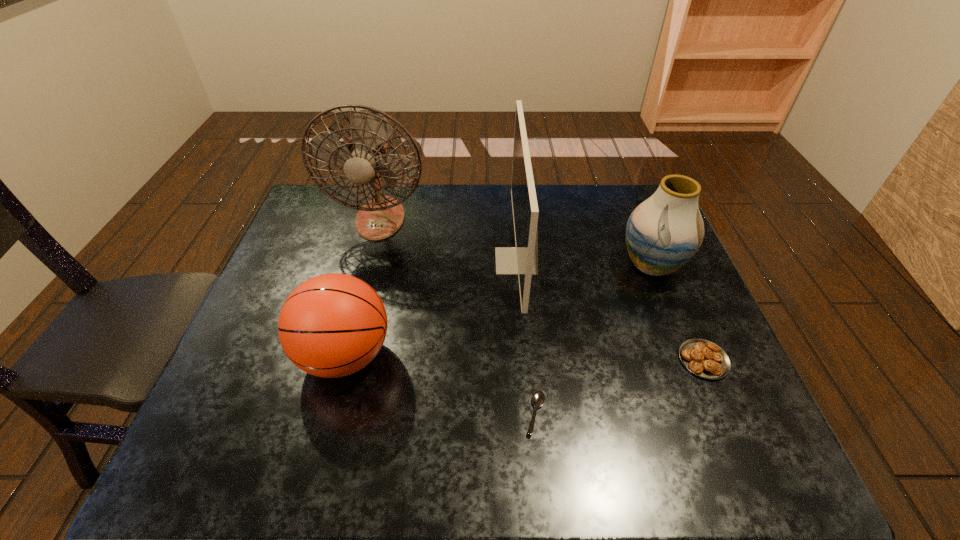
The image size is (960, 540). Find the location of `free space located on the front of the third tallest object`. free space located on the front of the third tallest object is located at coordinates (677, 327).

You are a GUI agent. You are given a task and a screenshot of the screen. Output one action in this format:
    pyautogui.click(x=<x>, y=<y>)
    Task: Click on the vacant space located on the left of the fourth tallest object
    
    Given the screenshot: What is the action you would take?
    pyautogui.click(x=238, y=355)

The width and height of the screenshot is (960, 540). What are the coordinates of `free space located 0.160m on the left of the pastry` in the screenshot? It's located at (612, 360).

Where is `free spot located on the left of the soupspoon`? The height and width of the screenshot is (540, 960). free spot located on the left of the soupspoon is located at coordinates (390, 414).

Identify the location of fan located at the far edge. Image resolution: width=960 pixels, height=540 pixels. (365, 159).

I want to click on monitor present at the far edge, so click(522, 260).

Find the location of a particular element. object that is at the near edge is located at coordinates (538, 398).

You are a GUI agent. You are given a task and a screenshot of the screen. Output one action in this format:
    pyautogui.click(x=<x>, y=<y>)
    Task: Click on the fan that is at the left edge
    The image size is (960, 540).
    Given the screenshot: What is the action you would take?
    pyautogui.click(x=365, y=159)

Locate an element on the screen. basketball at the left edge is located at coordinates (332, 325).

At what (x,y) coordinates should I click in order to perform the action: click on vase located in the right edge section of the desktop. Please return your answer as a coordinate pair (x, y). The height and width of the screenshot is (540, 960). Looking at the image, I should click on (663, 233).